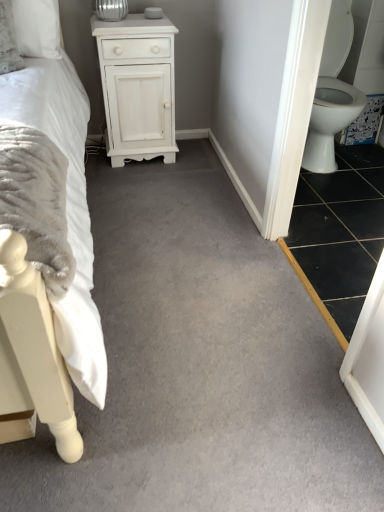
This screenshot has height=512, width=384. Identify the location of empty space that is ontop of white matte cabinet at upper center (from a real-world perspective). (129, 17).